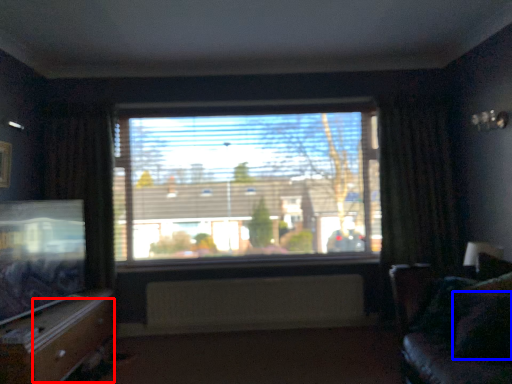
Question: Which object is closer to the camera taking this photo, drawer (highlighted by a red box) or pillow (highlighted by a blue box)?

Choices:
 (A) drawer
 (B) pillow

Answer: (B)